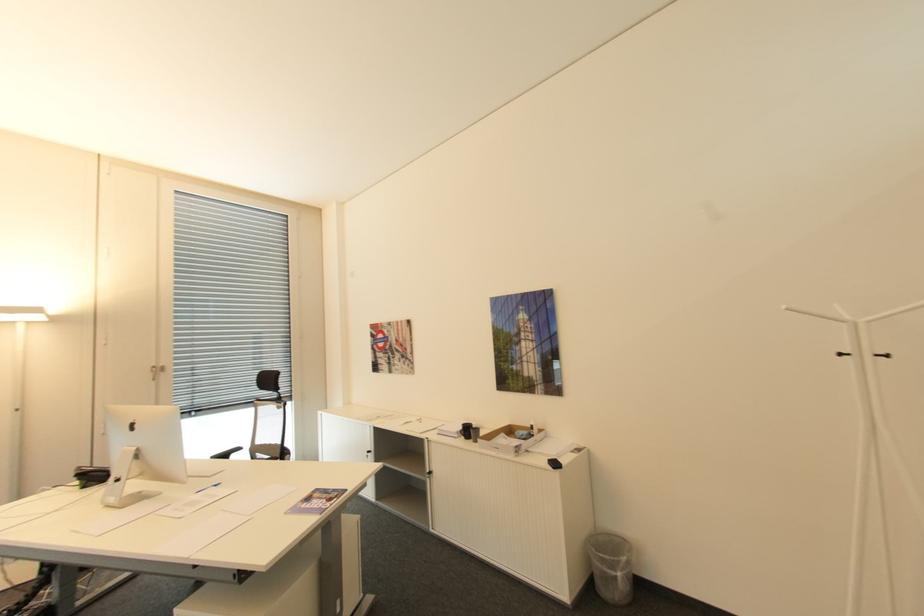
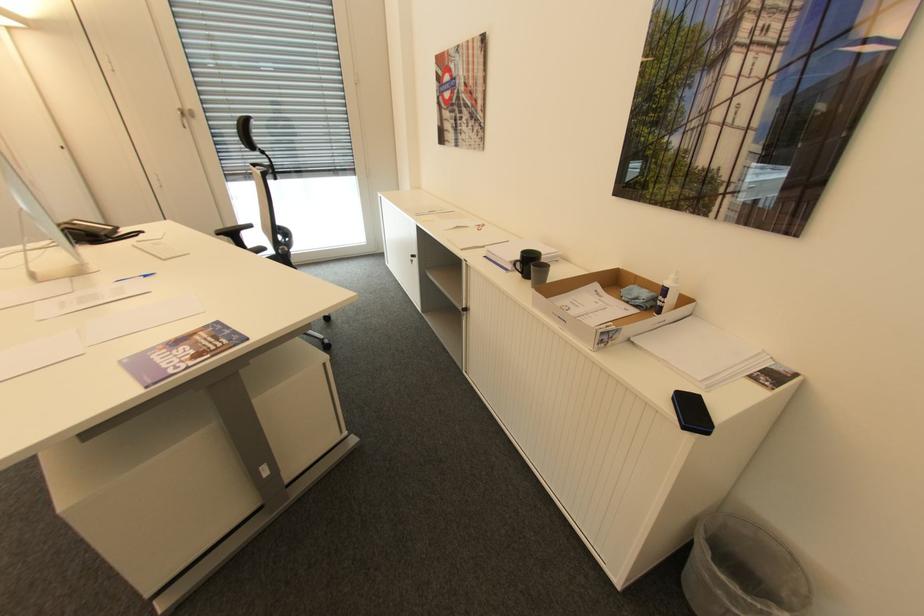
In the second image, find the point that corresponds to point (520, 451) in the first image.

(606, 342)